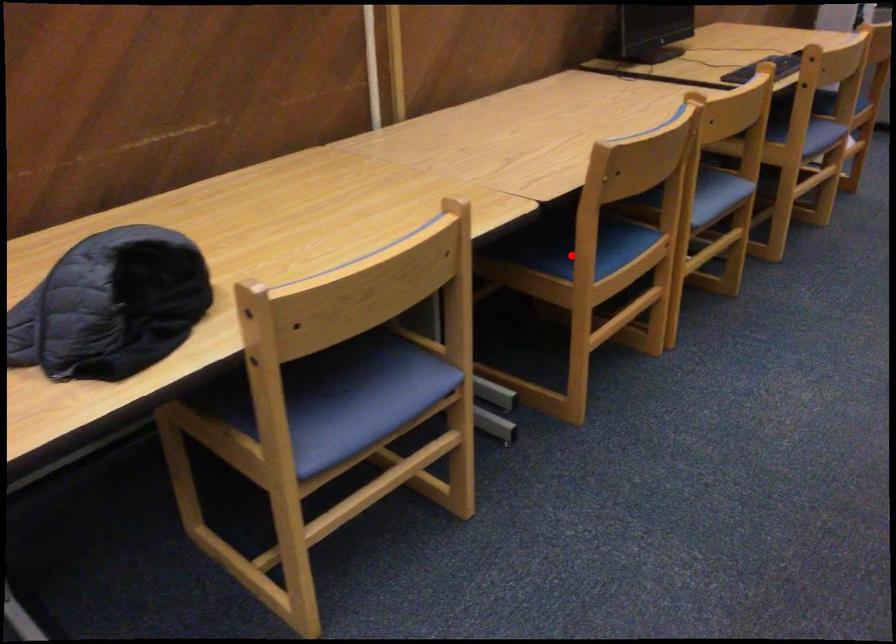
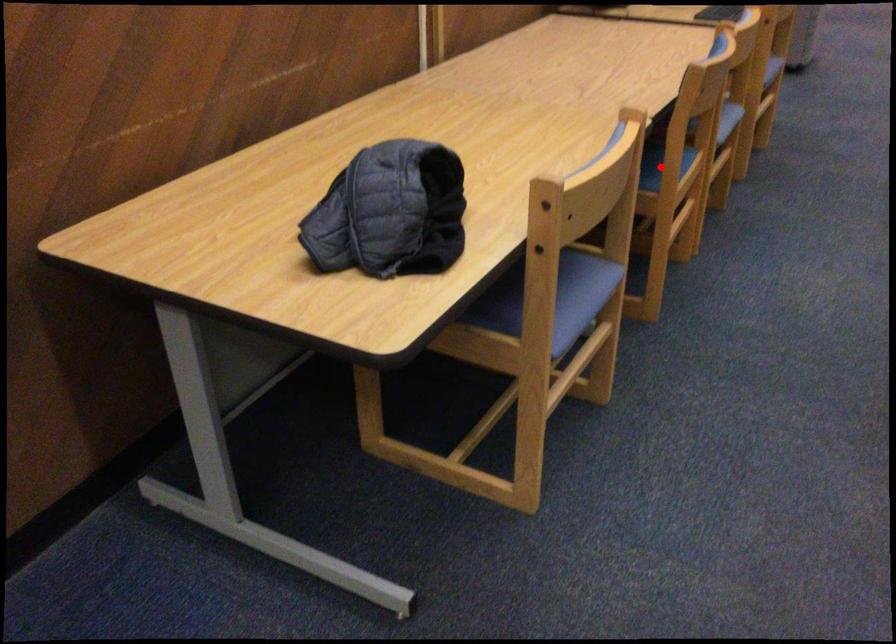
I am providing you with two images of the same scene from different viewpoints. A red point is marked on the first image and another point is marked on the second image. Does the point marked in image1 correspond to the same location as the one in image2?

Yes